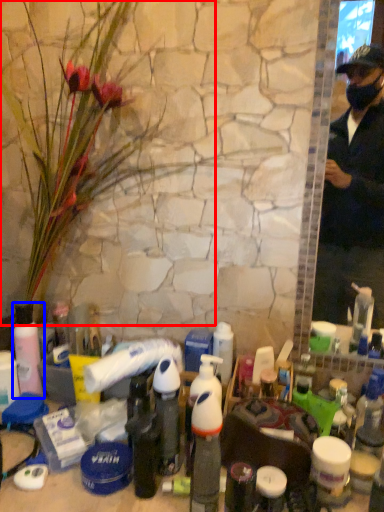
Question: Which object is closer to the camera taking this photo, flower (highlighted by a red box) or bottle (highlighted by a blue box)?

Choices:
 (A) flower
 (B) bottle

Answer: (A)